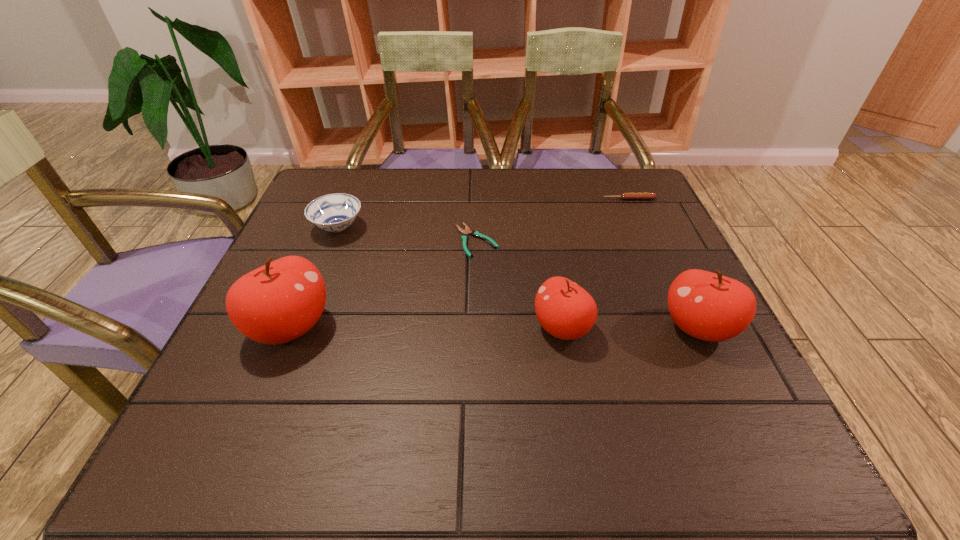
Find the location of a particular element. the leftmost apple is located at coordinates (276, 303).

Locate an element on the screen. The width and height of the screenshot is (960, 540). the third object from right to left is located at coordinates (565, 310).

The image size is (960, 540). I want to click on the shortest apple, so click(x=565, y=310).

Find the location of `the second tallest object`. the second tallest object is located at coordinates (708, 306).

Locate an element on the screen. The height and width of the screenshot is (540, 960). the second tallest apple is located at coordinates (708, 306).

Locate an element on the screen. The height and width of the screenshot is (540, 960). pliers is located at coordinates (467, 231).

This screenshot has width=960, height=540. In order to click on the third object from left to right in this screenshot , I will do `click(467, 231)`.

The image size is (960, 540). I want to click on the farthest object, so click(625, 196).

You are a GUI agent. You are given a task and a screenshot of the screen. Output one action in this format:
    pyautogui.click(x=<x>, y=<y>)
    Task: Click on the sausage
    This screenshot has height=540, width=960.
    Given the screenshot: What is the action you would take?
    pyautogui.click(x=625, y=196)

The width and height of the screenshot is (960, 540). I want to click on the third shortest object, so click(x=335, y=212).